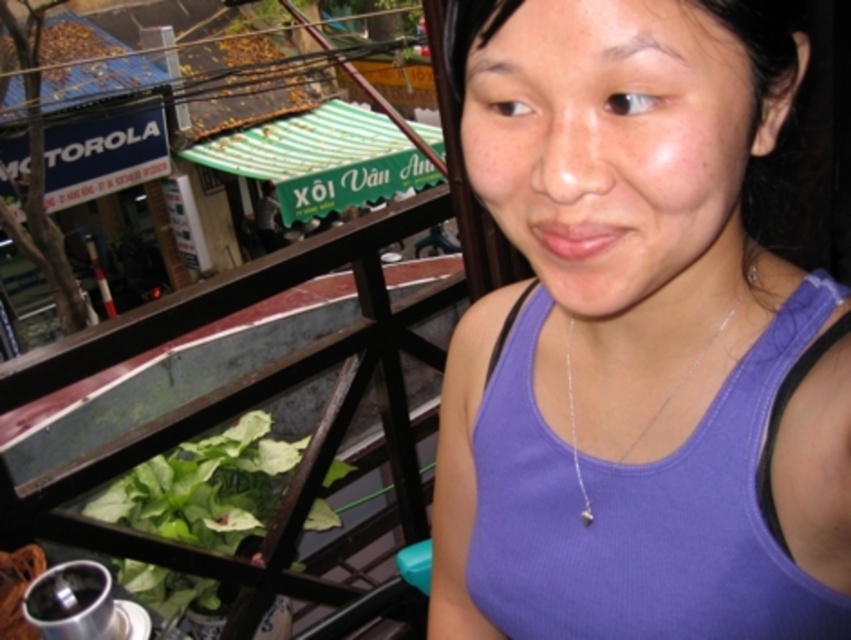
The person is wearing a purple ribbed tank top at center and a silver chain at center. Which clothing item is closer to the viewer?

The purple ribbed tank top at center is closer to the viewer because it is in front of the silver chain at center.

You are a fashion designer analyzing clothing items in an image. You notice the purple ribbed tank top at center and the silver chain at center. Which clothing item takes up more visual space in the image?

The purple ribbed tank top at center is larger in size than the silver chain at center, so it takes up more visual space in the image.